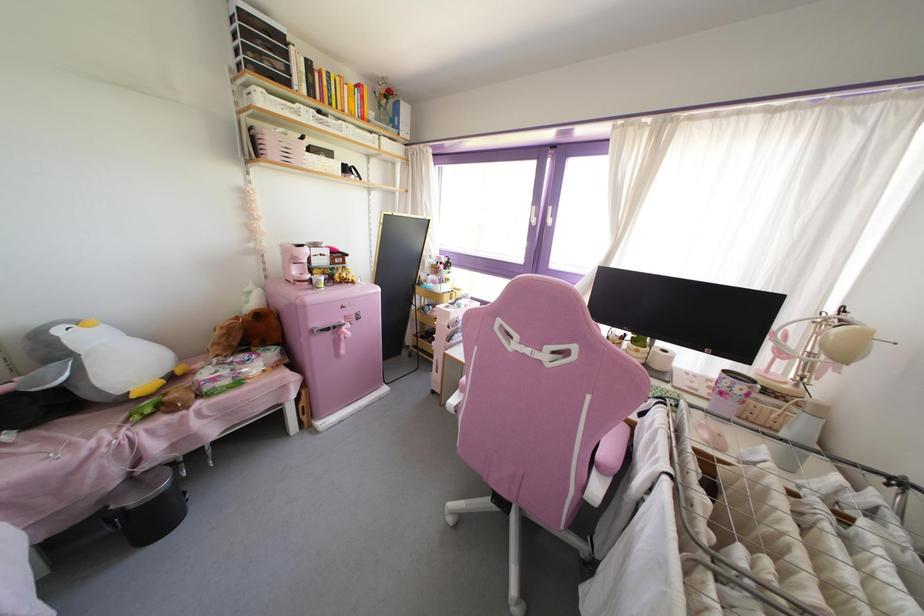
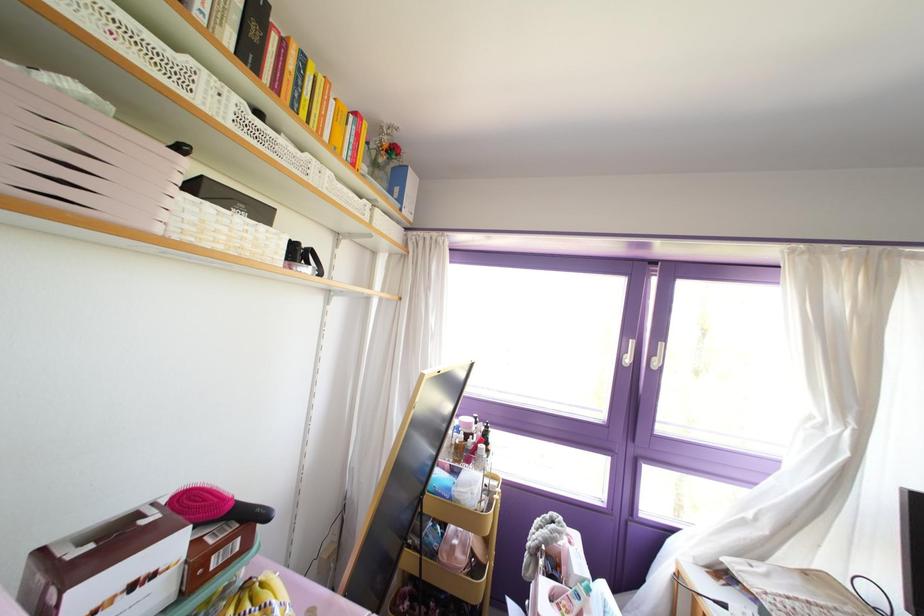
The point at (380, 105) is marked in the first image. Where is the corresponding point in the second image?

(372, 163)